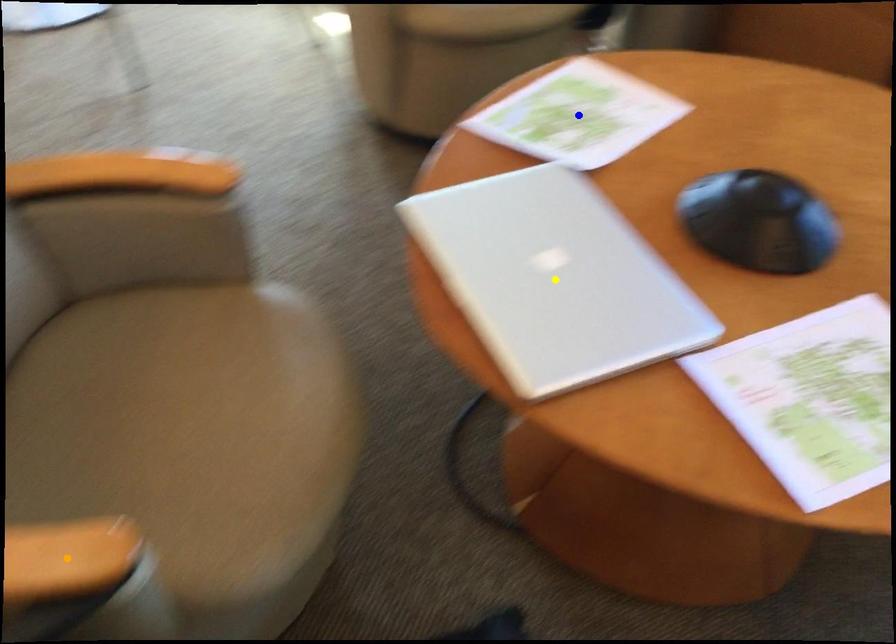
Order these from nearest to farthest:
yellow point, blue point, orange point

orange point
yellow point
blue point